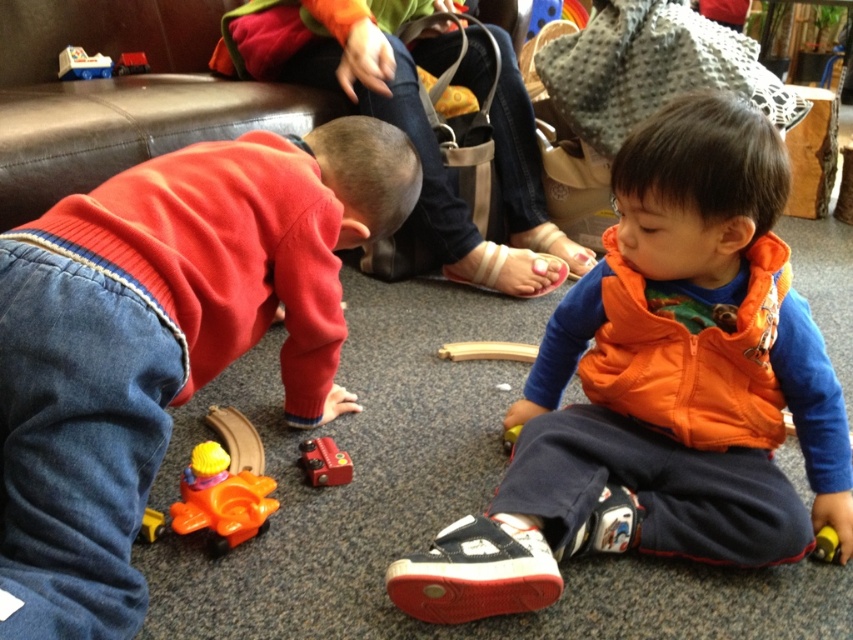
Question: Among these objects, which one is nearest to the camera?

Choices:
 (A) rubberized plastic toy car at center
 (B) orange plastic toy at lower left

Answer: (B)

Question: Considering the real-world distances, which object is farthest from the rubberized plastic toy car at center?

Choices:
 (A) yellow plastic toy at lower right
 (B) rubberized orange train at lower left
 (C) metallic red train at center
 (D) orange plastic toy at lower left

Answer: (A)

Question: Observing the image, what is the correct spatial positioning of matte orange vest at lower right in reference to rubberized orange train at lower left?

Choices:
 (A) above
 (B) below

Answer: (A)

Question: Is rubberized orange train at lower left thinner than rubberized plastic toy car at center?

Choices:
 (A) no
 (B) yes

Answer: (B)

Question: Among these objects, which one is nearest to the camera?

Choices:
 (A) matte orange vest at lower right
 (B) orange fleece vest at lower right
 (C) yellow plastic toy at lower right
 (D) metallic red train at center

Answer: (A)

Question: Does orange fleece vest at lower right appear over matte orange sweater at lower left?

Choices:
 (A) no
 (B) yes

Answer: (A)